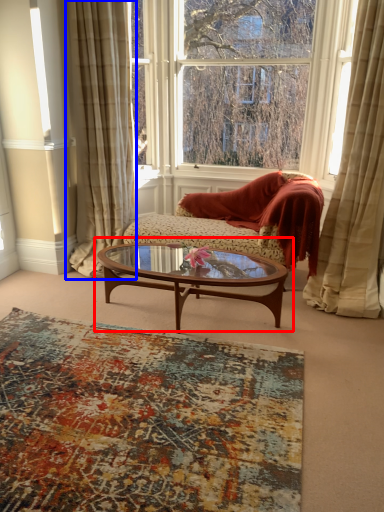
Question: Among these objects, which one is farthest to the camera, coffee table (highlighted by a red box) or curtain (highlighted by a blue box)?

Choices:
 (A) coffee table
 (B) curtain

Answer: (B)